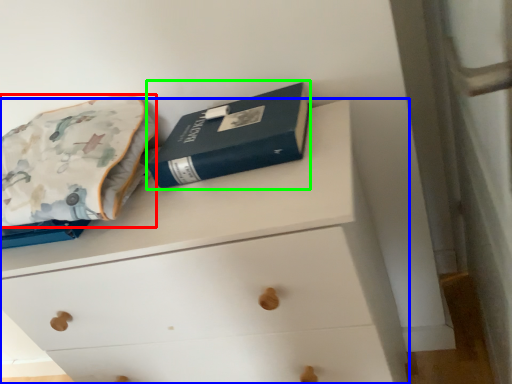
Question: Which object is the farthest from throw pillow (highlighted by a red box)? Choose among these: chest of drawers (highlighted by a blue box) or paperback book (highlighted by a green box).

Choices:
 (A) chest of drawers
 (B) paperback book

Answer: (A)